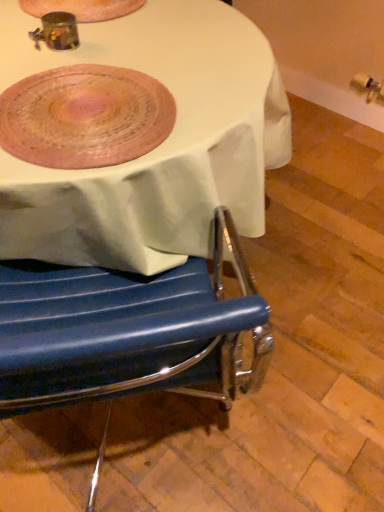
Where is `unoccupied region to the right of pink woven platter at upper left`? unoccupied region to the right of pink woven platter at upper left is located at coordinates (x=218, y=95).